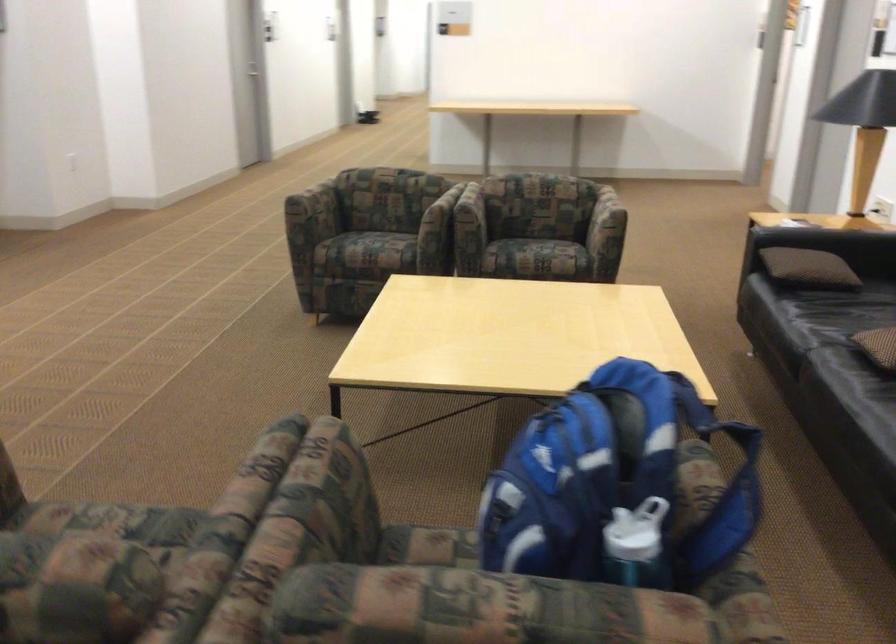
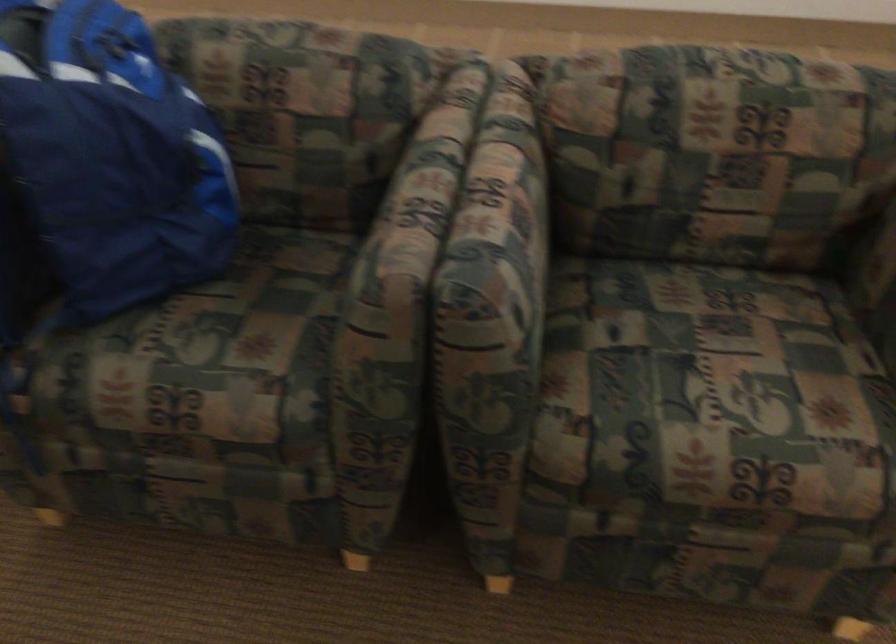
The point at (535, 460) is marked in the first image. Where is the corresponding point in the second image?

(112, 155)